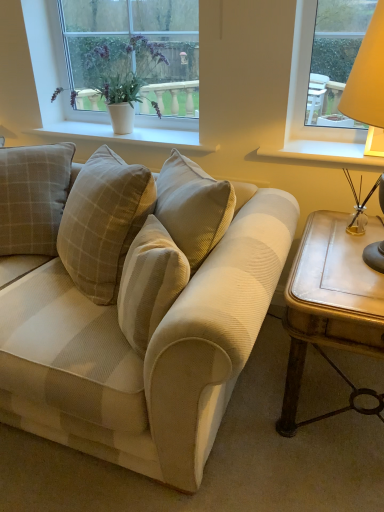
Question: Is white ceramic pot at upper left outside white textured pot at upper center, which is counted as the second window sill, starting from the right?

Choices:
 (A) no
 (B) yes

Answer: (B)

Question: Can you confirm if white ceramic pot at upper left is smaller than white textured pot at upper center, which is counted as the second window sill, starting from the right?

Choices:
 (A) no
 (B) yes

Answer: (A)

Question: Is white ceramic pot at upper left bigger than white textured pot at upper center, marked as the first window sill in a left-to-right arrangement?

Choices:
 (A) yes
 (B) no

Answer: (A)

Question: Is white ceramic pot at upper left positioned with its back to white textured pot at upper center, marked as the first window sill in a left-to-right arrangement?

Choices:
 (A) no
 (B) yes

Answer: (A)

Question: Considering the relative sizes of white ceramic pot at upper left and white textured pot at upper center, marked as the first window sill in a left-to-right arrangement, in the image provided, is white ceramic pot at upper left wider than white textured pot at upper center, marked as the first window sill in a left-to-right arrangement,?

Choices:
 (A) no
 (B) yes

Answer: (B)

Question: Is the surface of white ceramic pot at upper left in direct contact with white textured pot at upper center, which is counted as the second window sill, starting from the right?

Choices:
 (A) no
 (B) yes

Answer: (A)

Question: Is matte yellow lampshade at right not inside beige corduroy couch at center?

Choices:
 (A) yes
 (B) no

Answer: (A)

Question: Can you confirm if matte yellow lampshade at right is wider than beige corduroy couch at center?

Choices:
 (A) yes
 (B) no

Answer: (B)

Question: From the image's perspective, does matte yellow lampshade at right appear higher than beige corduroy couch at center?

Choices:
 (A) no
 (B) yes

Answer: (B)

Question: From the image's perspective, is matte yellow lampshade at right below beige corduroy couch at center?

Choices:
 (A) no
 (B) yes

Answer: (A)

Question: From a real-world perspective, is matte yellow lampshade at right physically above beige corduroy couch at center?

Choices:
 (A) no
 (B) yes

Answer: (B)

Question: Is the depth of matte yellow lampshade at right less than that of beige corduroy couch at center?

Choices:
 (A) yes
 (B) no

Answer: (B)

Question: Can you confirm if beige corduroy pillow at center is positioned to the right of white painted wood at right, the 1th window sill viewed from the right?

Choices:
 (A) yes
 (B) no

Answer: (B)